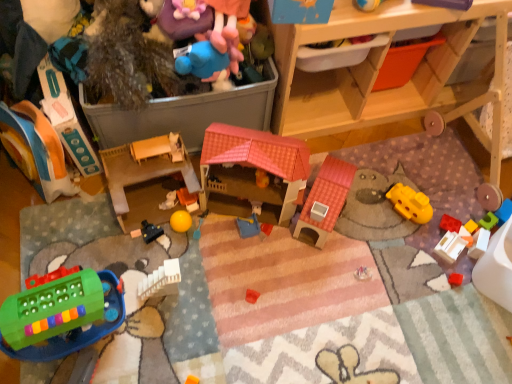
Where is `vacant area to the left of translucent plastic cube at center, which is counted as the 13th toy, starting from the left`? vacant area to the left of translucent plastic cube at center, which is counted as the 13th toy, starting from the left is located at coordinates (425, 230).